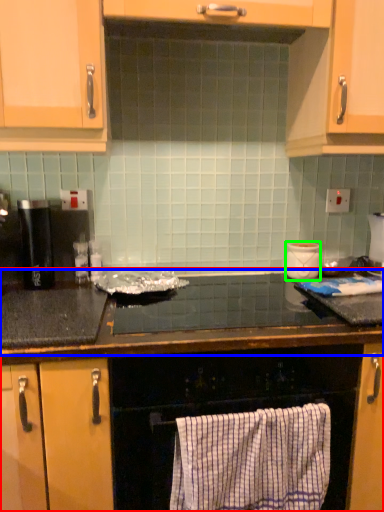
Question: Based on their relative distances, which object is farther from countertop (highlighted by a red box)? Choose from countertop (highlighted by a blue box) and appliance (highlighted by a green box).

Choices:
 (A) countertop
 (B) appliance

Answer: (B)